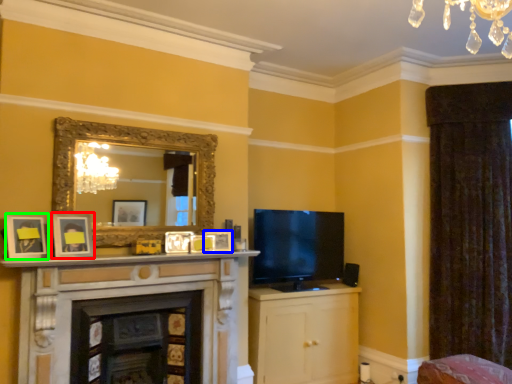
Question: Considering the real-world distances, which object is closest to picture frame (highlighted by a red box)? picture frame (highlighted by a blue box) or picture frame (highlighted by a green box).

Choices:
 (A) picture frame
 (B) picture frame

Answer: (B)